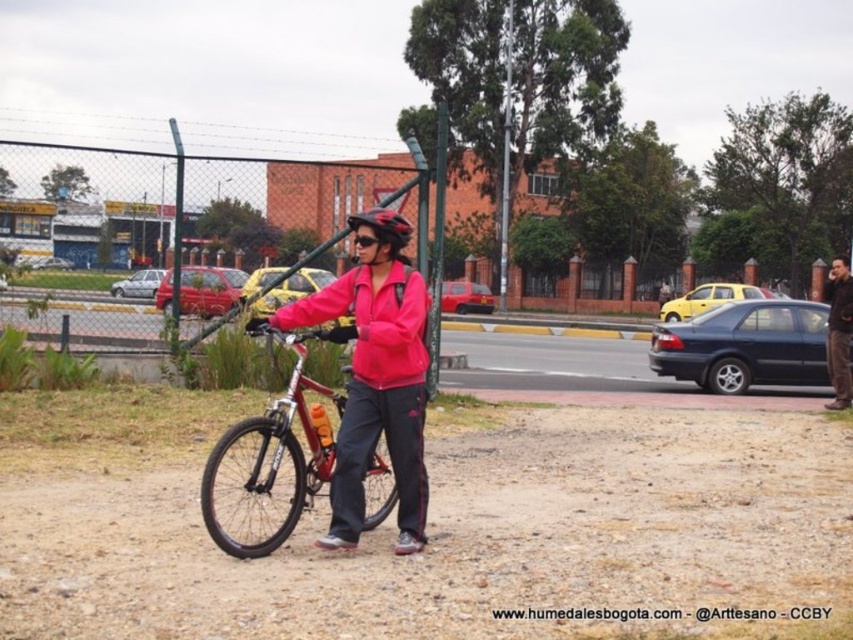
Question: Among these objects, which one is nearest to the camera?

Choices:
 (A) shiny black helmet at center
 (B) dark brown leather jacket at right

Answer: (A)

Question: Is matte pink jacket at center to the left of shiny black helmet at center from the viewer's perspective?

Choices:
 (A) no
 (B) yes

Answer: (B)

Question: Among these points, which one is farthest from the camera?

Choices:
 (A) (375, 348)
 (B) (836, 369)
 (C) (398, 240)

Answer: (B)

Question: Which object is farther from the camera taking this photo?

Choices:
 (A) pink matte jacket at center
 (B) matte pink jacket at center
 (C) shiny black helmet at center
 (D) shiny metallic bicycle at center

Answer: (C)

Question: Does shiny metallic bicycle at center come in front of dark brown leather jacket at right?

Choices:
 (A) no
 (B) yes

Answer: (B)

Question: Is pink matte jacket at center wider than shiny metallic bicycle at center?

Choices:
 (A) yes
 (B) no

Answer: (B)